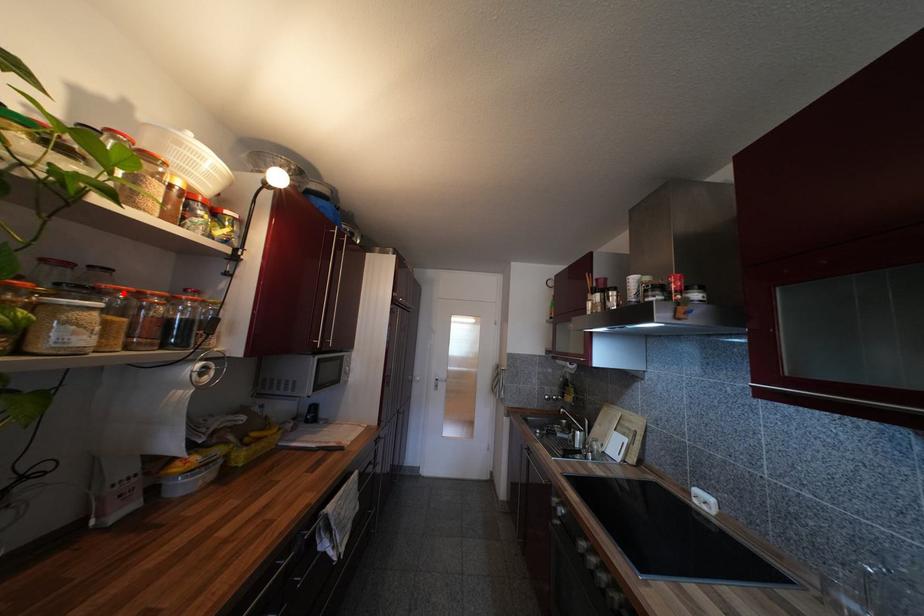
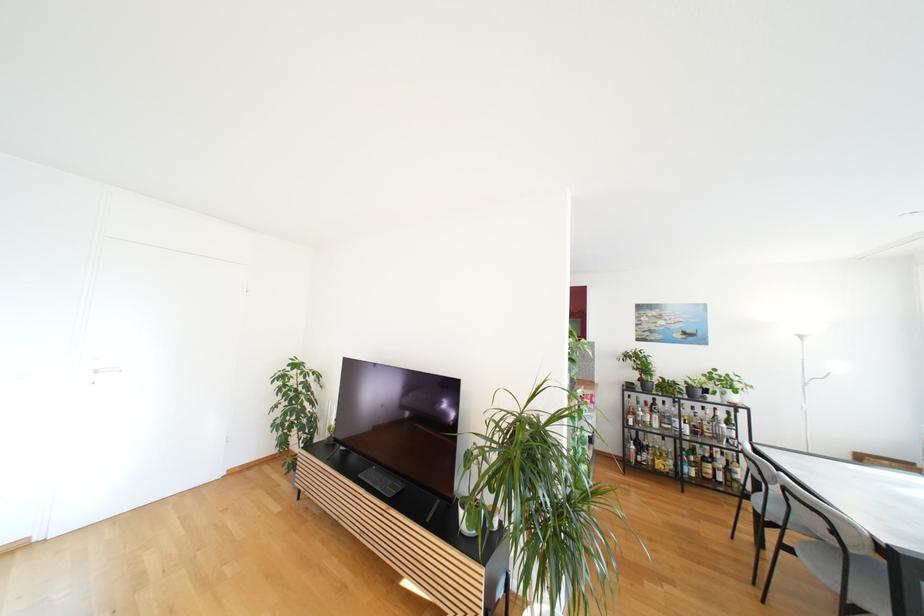
Question: I am providing you with two images of the same scene from different viewpoints. A red point is marked on the first image. At the location where the point appears in image 1, is it still visible in image 2?

Choices:
 (A) Yes
 (B) No

Answer: (B)